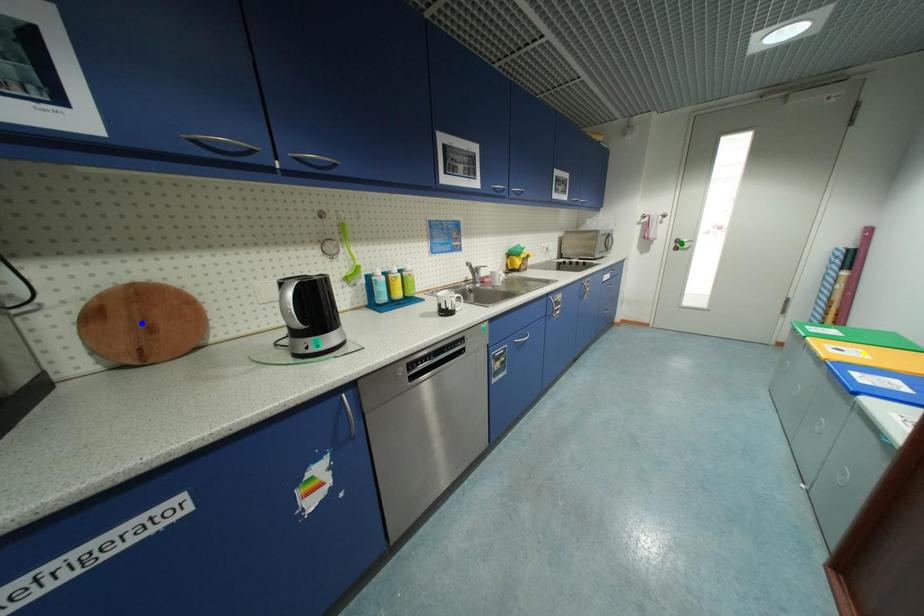
Order these from nearest to farthest:
yellow point | green point | blue point

blue point
yellow point
green point